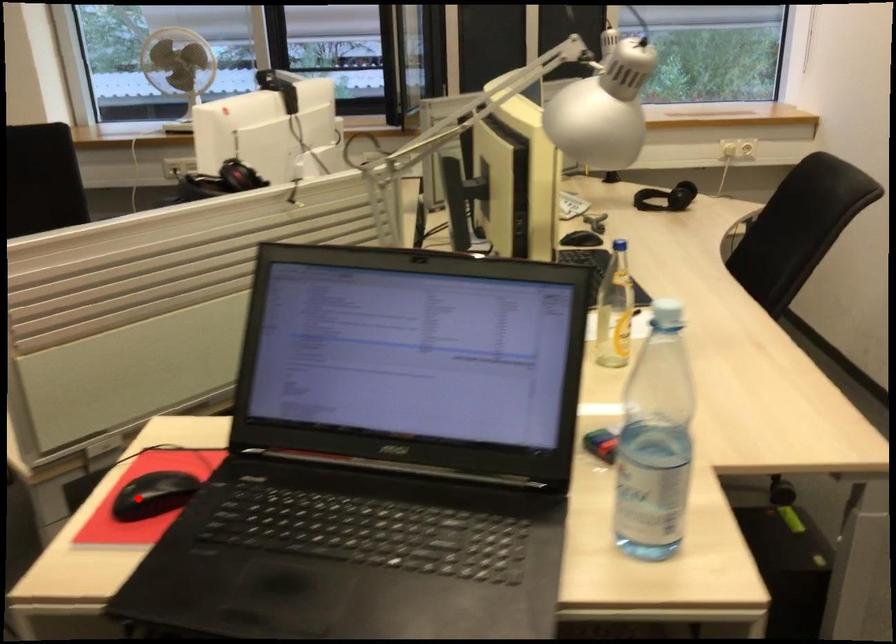
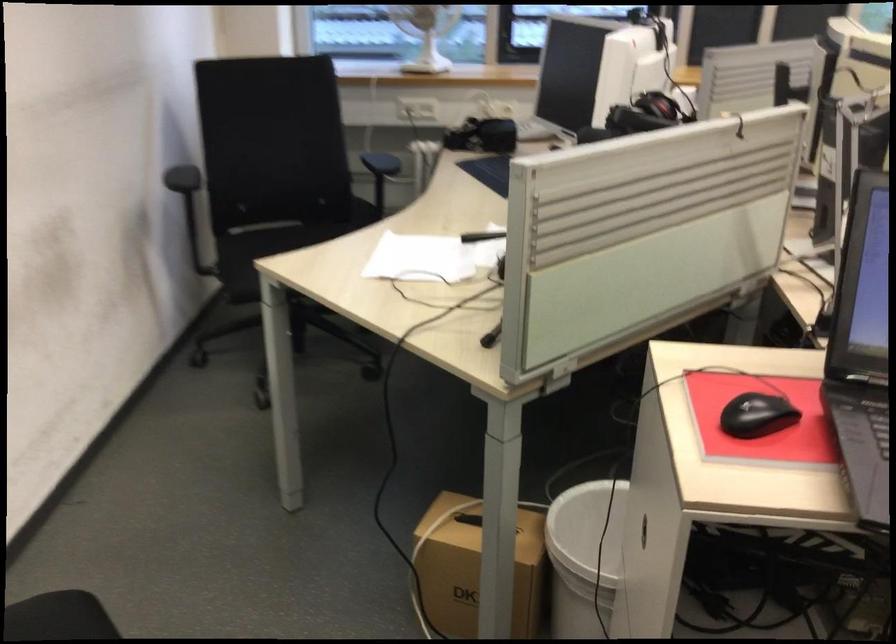
Question: I am providing you with two images of the same scene from different viewpoints. A red point is marked on the first image. Can you still see the location of the red point in image 2?

Choices:
 (A) Yes
 (B) No

Answer: (A)